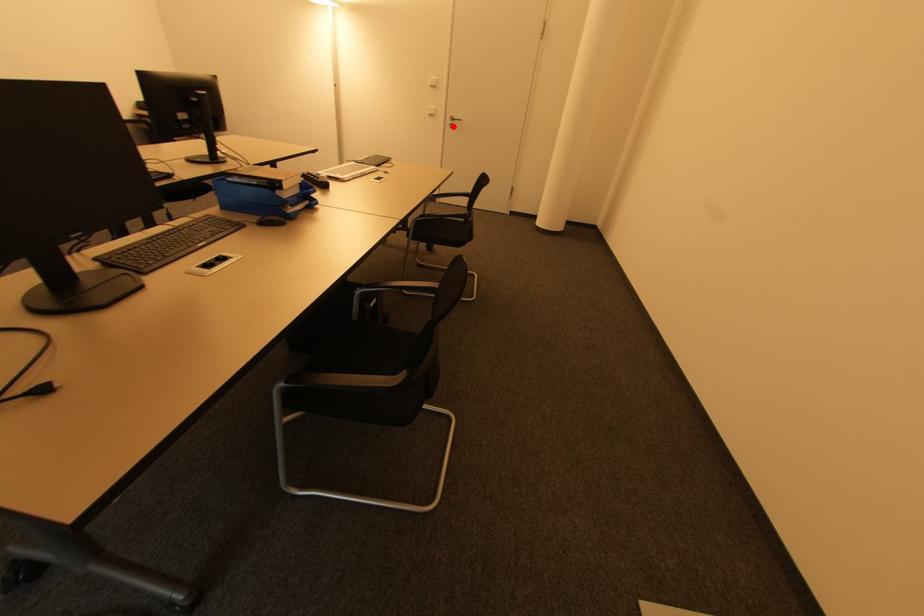
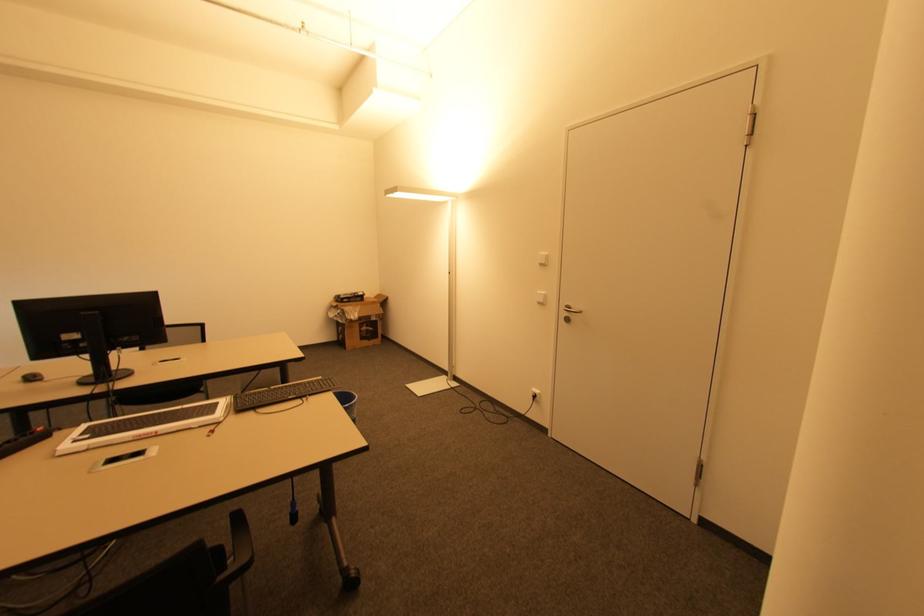
Question: I am providing you with two images of the same scene from different viewpoints. A red point is shown in image1. For the corresponding object point in image2, is it positioned nearer or farther from the camera?

Choices:
 (A) Nearer
 (B) Farther

Answer: (B)